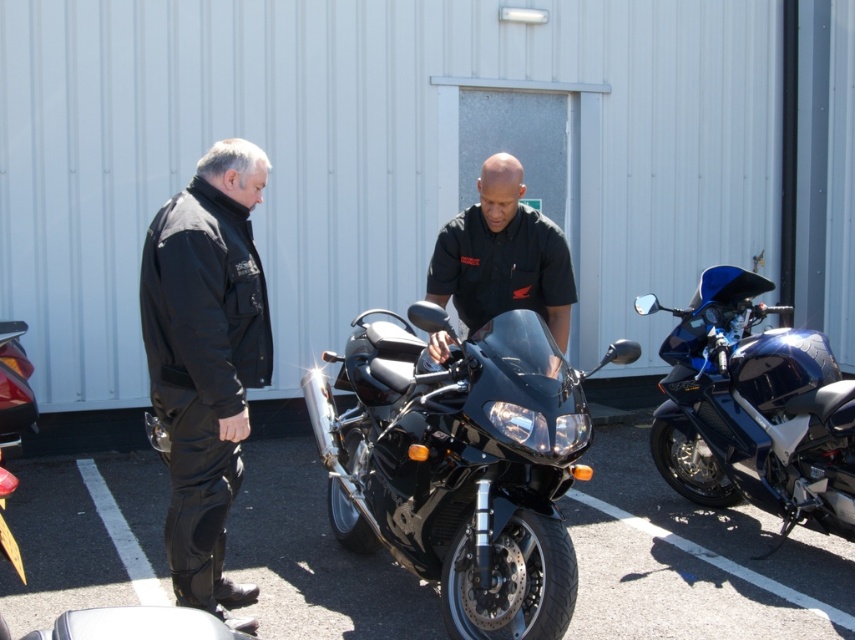
Does black metallic motorcycle at center have a lesser height compared to glossy blue motorcycle at right?

Indeed, black metallic motorcycle at center has a lesser height compared to glossy blue motorcycle at right.

Between point (451, 458) and point (735, 268), which one is positioned behind?

The point (735, 268) is more distant.

Does point (531, 588) come farther from viewer compared to point (775, 390)?

That is False.

You are a GUI agent. You are given a task and a screenshot of the screen. Output one action in this format:
    pyautogui.click(x=<x>, y=<y>)
    Task: Click on the black metallic motorcycle at center
    The height and width of the screenshot is (640, 855).
    Given the screenshot: What is the action you would take?
    pyautogui.click(x=461, y=464)

Does glossy blue motorcycle at right have a lesser height compared to black smooth shirt at center?

No.

Based on the photo, is glossy blue motorcycle at right wider than black smooth shirt at center?

Yes, glossy blue motorcycle at right is wider than black smooth shirt at center.

Locate an element on the screen. glossy blue motorcycle at right is located at coordinates (753, 410).

Can you confirm if black metallic motorcycle at center is taller than black smooth shirt at center?

Indeed, black metallic motorcycle at center has a greater height compared to black smooth shirt at center.

Does black metallic motorcycle at center have a lesser height compared to black smooth shirt at center?

No, black metallic motorcycle at center is not shorter than black smooth shirt at center.

Which is in front, point (329, 490) or point (563, 298)?

Positioned in front is point (563, 298).

Locate an element on the screen. Image resolution: width=855 pixels, height=640 pixels. black metallic motorcycle at center is located at coordinates (461, 464).